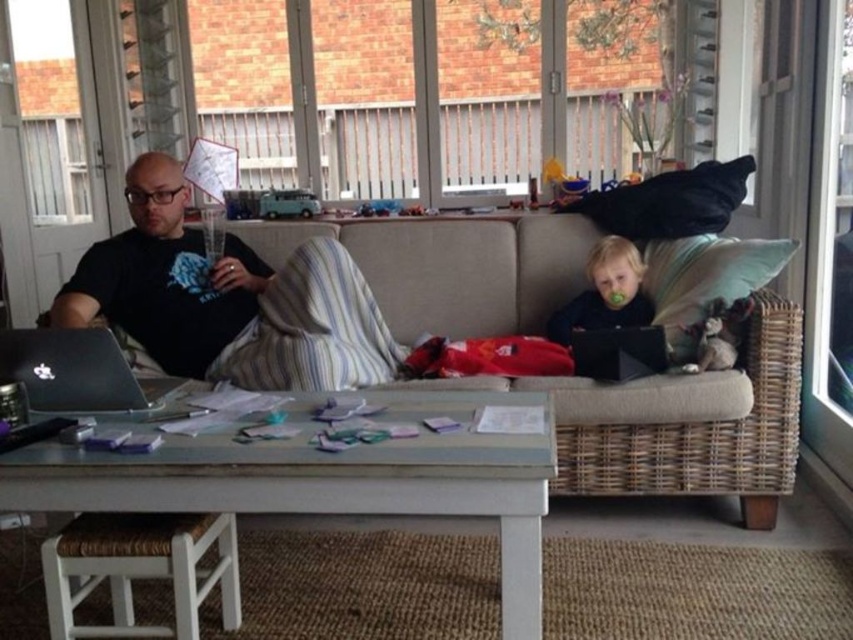
Can you confirm if matte black laptop at right is taller than black matte laptop at right?

Yes.

This screenshot has height=640, width=853. In order to click on matte black laptop at right in this screenshot , I will do `click(605, 292)`.

Can you confirm if black matte laptop at left is smaller than black matte laptop at right?

Incorrect, black matte laptop at left is not smaller in size than black matte laptop at right.

What are the coordinates of `black matte laptop at left` in the screenshot? It's located at (164, 276).

This screenshot has height=640, width=853. What are the coordinates of `black matte laptop at left` in the screenshot? It's located at (164, 276).

Does point (666, 390) come in front of point (115, 308)?

Yes, it is in front of point (115, 308).

The width and height of the screenshot is (853, 640). What do you see at coordinates (689, 426) in the screenshot? I see `beige fabric couch at center` at bounding box center [689, 426].

Locate an element on the screen. The width and height of the screenshot is (853, 640). beige fabric couch at center is located at coordinates (689, 426).